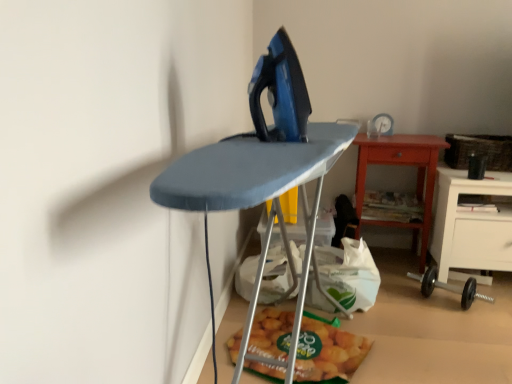
Locate an element on the screen. The width and height of the screenshot is (512, 384). vacant space underneath black rubber dumbbell at lower right (from a real-world perspective) is located at coordinates (439, 297).